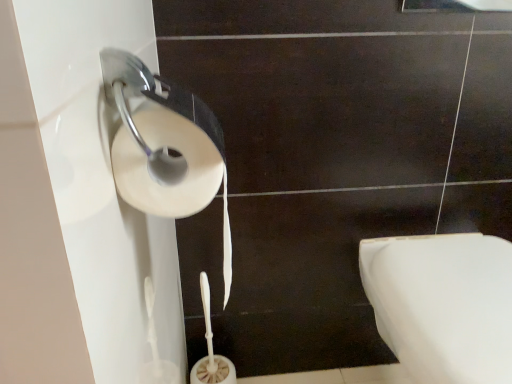
Question: From a real-world perspective, relative to white glossy toilet at lower right, is white matte toilet paper at left vertically above or below?

Choices:
 (A) above
 (B) below

Answer: (A)

Question: Relative to white glossy toilet at lower right, is white matte toilet paper at left in front or behind?

Choices:
 (A) front
 (B) behind

Answer: (A)

Question: In the image, is white matte toilet paper at left on the left side or the right side of white glossy toilet at lower right?

Choices:
 (A) right
 (B) left

Answer: (B)

Question: Looking at their shapes, would you say white glossy toilet at lower right is wider or thinner than white matte toilet paper at left?

Choices:
 (A) wide
 (B) thin

Answer: (A)

Question: Would you say white glossy toilet at lower right is to the left or to the right of white matte toilet paper at left in the picture?

Choices:
 (A) right
 (B) left

Answer: (A)

Question: Considering the positions of white glossy toilet at lower right and white matte toilet paper at left in the image, is white glossy toilet at lower right bigger or smaller than white matte toilet paper at left?

Choices:
 (A) small
 (B) big

Answer: (B)

Question: Considering the positions of point (394, 336) and point (134, 172), is point (394, 336) closer or farther from the camera than point (134, 172)?

Choices:
 (A) closer
 (B) farther

Answer: (B)